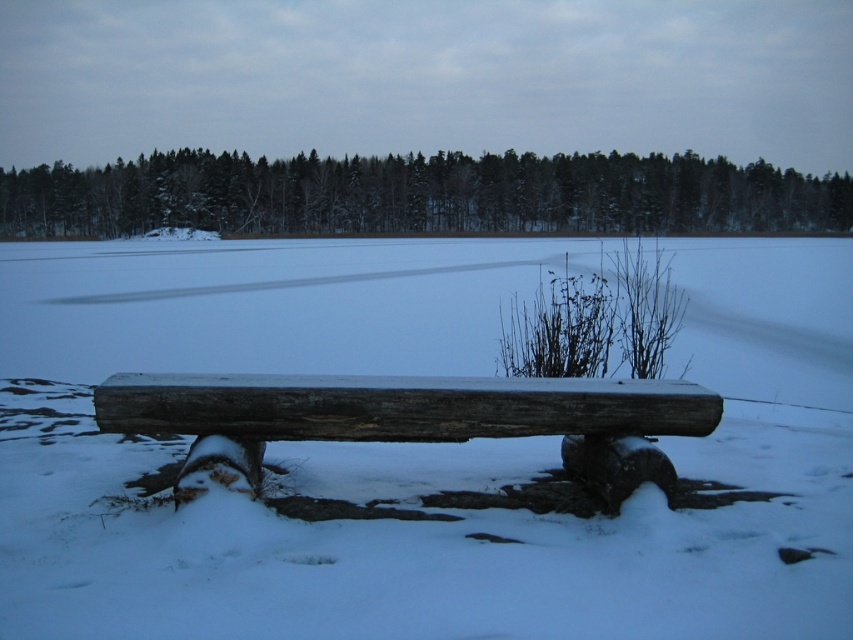
Is point (764, 298) in front of point (96, 196)?

Yes.

Image resolution: width=853 pixels, height=640 pixels. Find the location of `white snow at center`. white snow at center is located at coordinates (413, 449).

Is point (482, 352) positioned in front of point (611, 196)?

Yes, it is.

Where is `white snow at center`? This screenshot has width=853, height=640. white snow at center is located at coordinates (413, 449).

Describe the element at coordinates (413, 449) in the screenshot. I see `white snow at center` at that location.

Does white snow at center appear on the right side of weathered wood bench at center?

Yes, white snow at center is to the right of weathered wood bench at center.

Find the location of a particular element. This screenshot has width=853, height=640. white snow at center is located at coordinates (413, 449).

Can you confirm if green matte trees at upper center is positioned above weathered wood bench at center?

Indeed, green matte trees at upper center is positioned over weathered wood bench at center.

This screenshot has height=640, width=853. What do you see at coordinates (421, 195) in the screenshot? I see `green matte trees at upper center` at bounding box center [421, 195].

Identify the location of green matte trees at upper center. (421, 195).